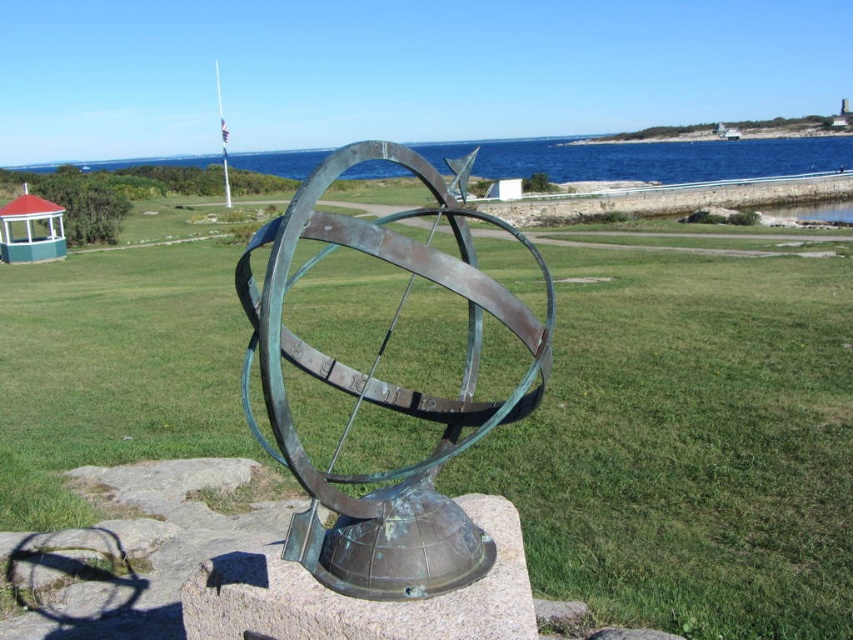
Question: Is green grass at center wider than blue water at upper center?

Choices:
 (A) no
 (B) yes

Answer: (A)

Question: Which point is farther to the camera?

Choices:
 (A) bronze/green patina sphere at center
 (B) blue water at upper center

Answer: (B)

Question: Can you confirm if green grass at center is positioned to the right of bronze/textured stone at center?

Choices:
 (A) yes
 (B) no

Answer: (B)

Question: Which point is farther to the camera?

Choices:
 (A) bronze/green patina sphere at center
 (B) bronze/textured stone at center

Answer: (B)

Question: Which object is positioned closest to the green grass at center?

Choices:
 (A) bronze/green patina sphere at center
 (B) blue water at upper center
 (C) bronze/textured stone at center

Answer: (A)

Question: Observing the image, what is the correct spatial positioning of green grass at center in reference to blue water at upper center?

Choices:
 (A) above
 (B) below

Answer: (B)